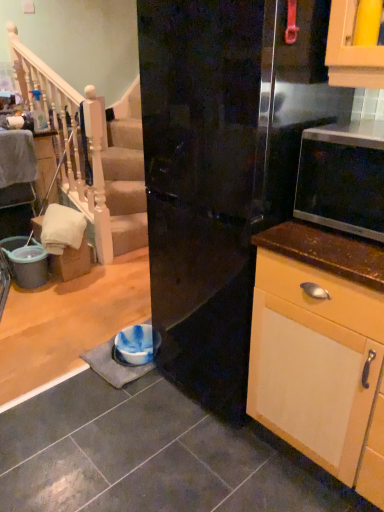
The height and width of the screenshot is (512, 384). Identify the location of free location to the left of glossy black refrigerator at center. (104, 414).